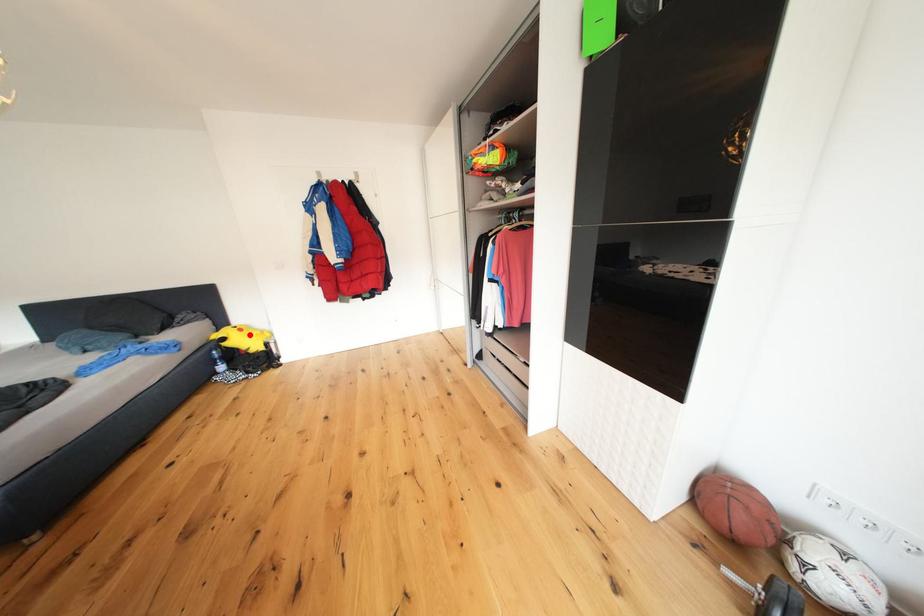
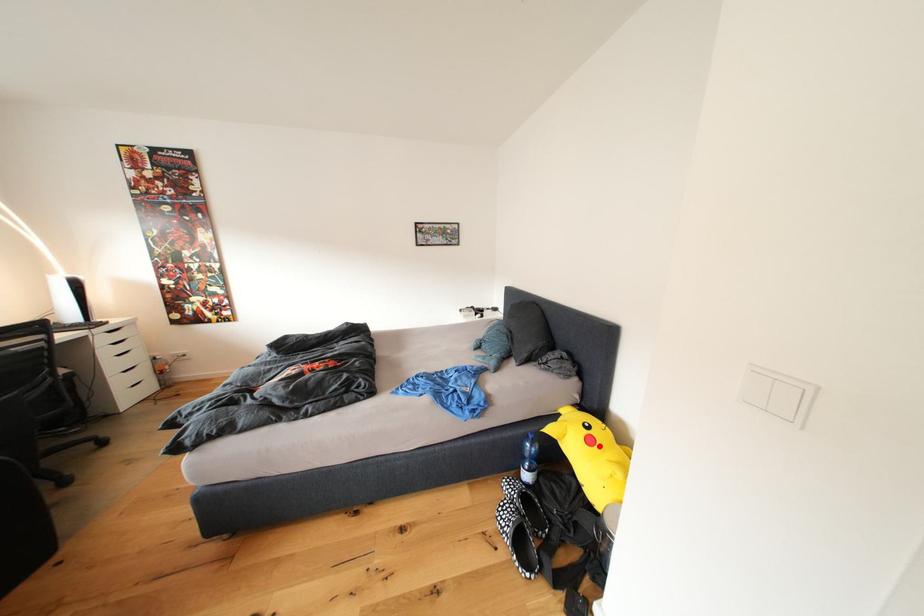
I am providing you with two images of the same scene from different viewpoints. A red point is marked on the first image and another point is marked on the second image. Are the points marked in image1 and image2 representing the same 3D position?

Yes